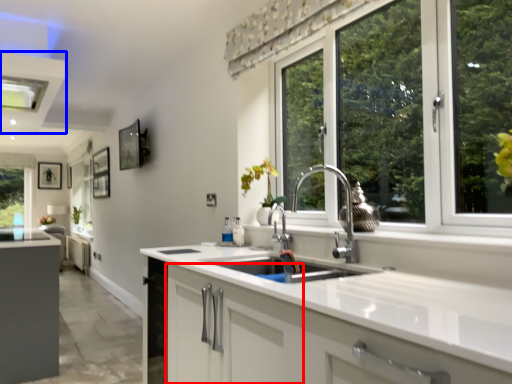
Question: Which object is further to the camera taking this photo, cabinetry (highlighted by a red box) or exhaust hood (highlighted by a blue box)?

Choices:
 (A) cabinetry
 (B) exhaust hood

Answer: (B)